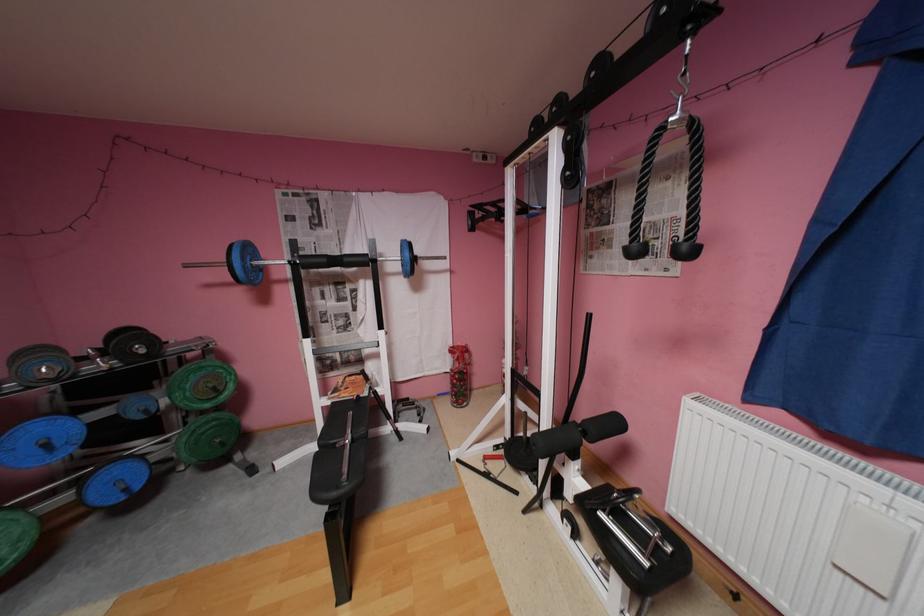
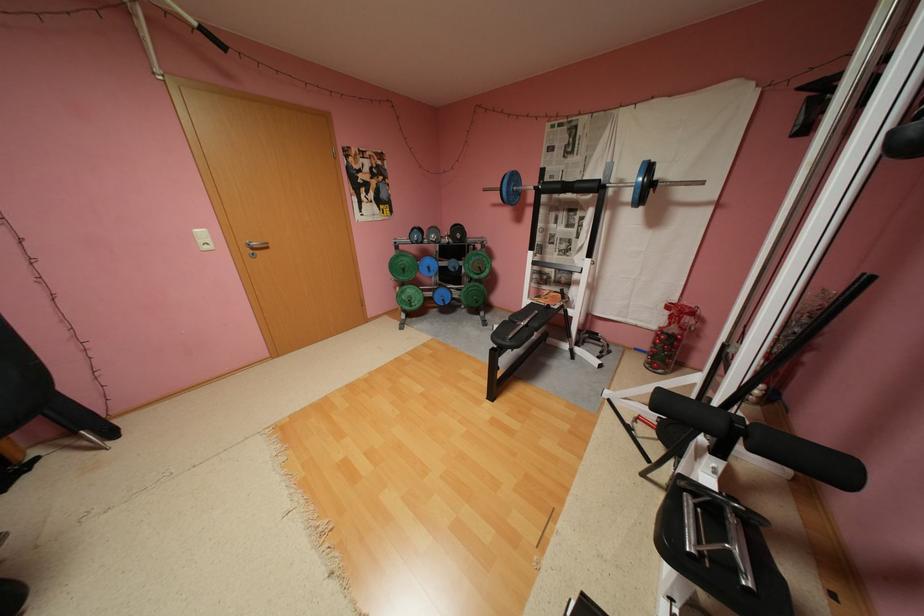
In the second image, find the point that corresponds to (x=253, y=268) in the first image.

(517, 191)